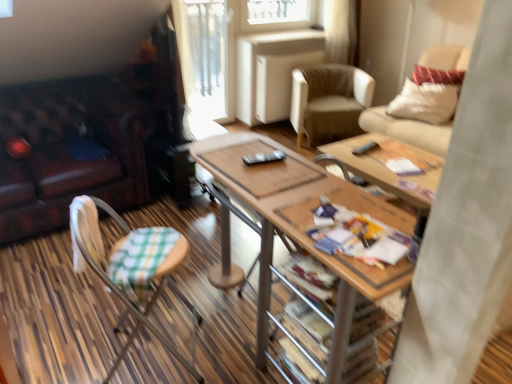
This screenshot has height=384, width=512. I want to click on empty space that is to the right of black plastic remote control at center, the second remote control positioned from the right, so click(x=298, y=167).